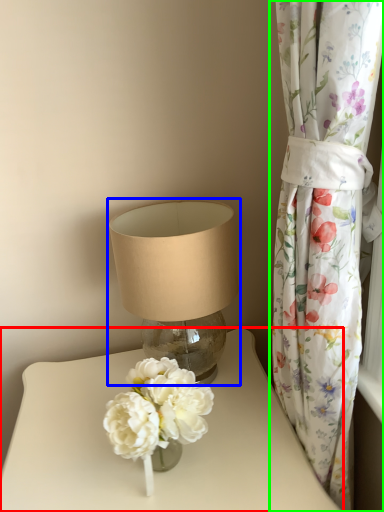
Question: Considering the real-world distances, which object is farthest from table (highlighted by a red box)? lamp (highlighted by a blue box) or curtain (highlighted by a green box)?

Choices:
 (A) lamp
 (B) curtain

Answer: (B)